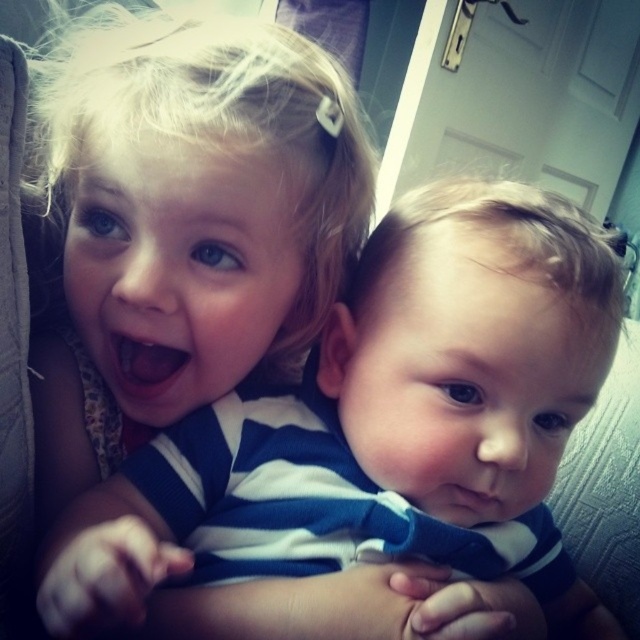
You are a photographer trying to capture a photo of both children in the image. You notice two points marked on the image, point A at coordinates point (483, 198) and point B at coordinates point (196, 129). To ensure both children are in focus, you need to adjust your camera focus. Which point should you focus on first to ensure the child closer to the camera is in focus?

Point B at coordinates point (196, 129) should be focused on first because it is closer to the camera than point A at coordinates point (483, 198), ensuring the child nearer to the camera is in focus.

You are a photographer trying to capture a closeup of the blue striped shirt at center. Given that the camera focuses on the point at coordinates point (384, 422), will this point be on the blue striped shirt at center?

Yes, the point (384, 422) corresponds to the blue striped shirt at center, so the camera will focus on the blue striped shirt at center.